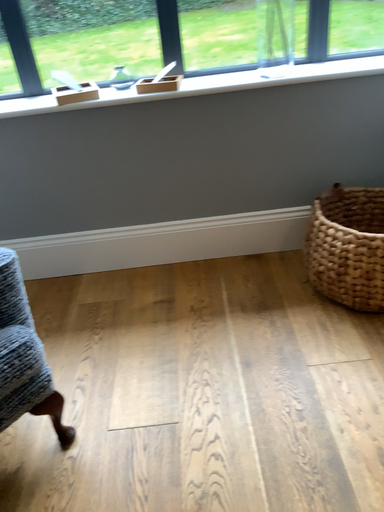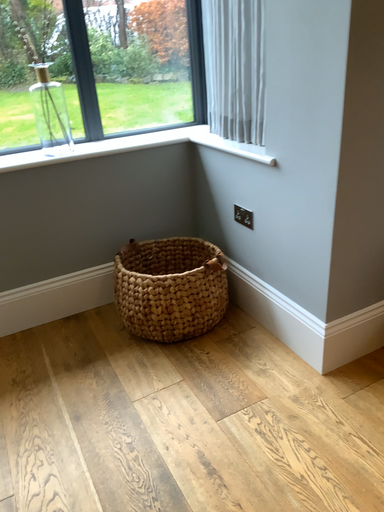
Question: Which way did the camera rotate in the video?

Choices:
 (A) rotated left
 (B) rotated right

Answer: (B)